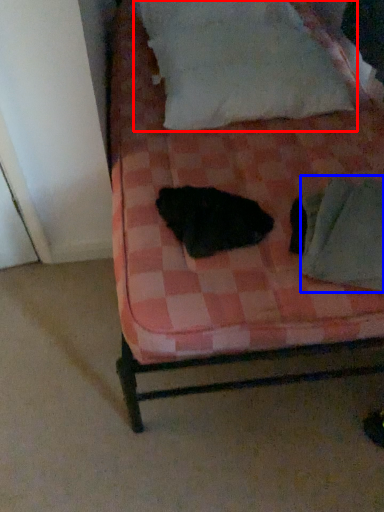
Question: Which object appears closest to the camera in this image, pillow (highlighted by a red box) or linen (highlighted by a blue box)?

Choices:
 (A) pillow
 (B) linen

Answer: (B)